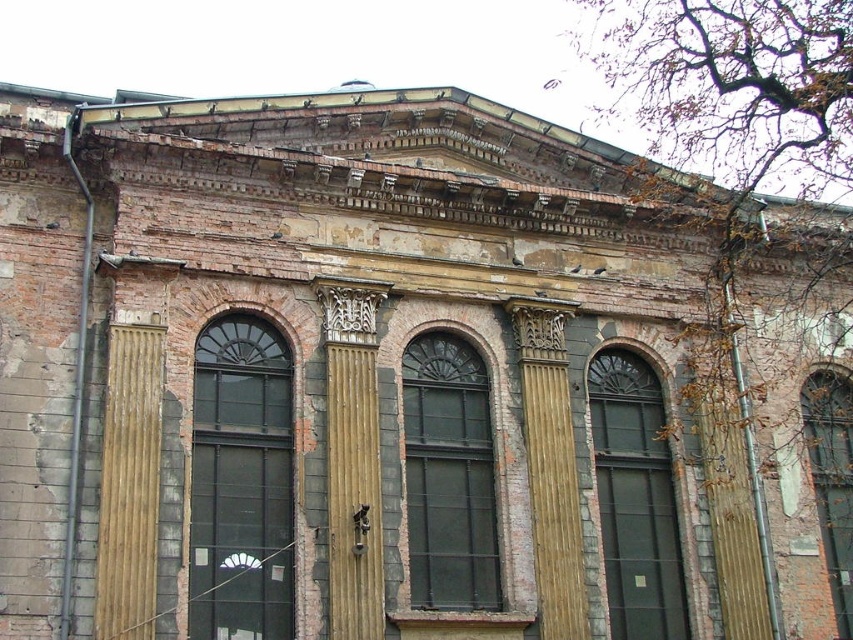
What are the coordinates of `dark gray glass window at center left` in the screenshot? It's located at (241, 483).

Find the location of a particular element. This screenshot has height=640, width=853. dark gray glass window at center left is located at coordinates (241, 483).

Is dark gray glass window at center left to the right of dark gray glass window at right from the viewer's perspective?

No, dark gray glass window at center left is not to the right of dark gray glass window at right.

Which of these two, dark gray glass window at center left or dark gray glass window at right, stands shorter?

dark gray glass window at center left is shorter.

Is point (204, 332) behind point (839, 428)?

No, it is not.

Where is `dark gray glass window at center left`? This screenshot has height=640, width=853. dark gray glass window at center left is located at coordinates (241, 483).

Is point (263, 340) positioned behind point (560, 611)?

Yes.

Is point (242, 323) positioned after point (564, 477)?

No, (242, 323) is in front of (564, 477).

This screenshot has width=853, height=640. What are the coordinates of `dark gray glass window at center left` in the screenshot? It's located at (241, 483).